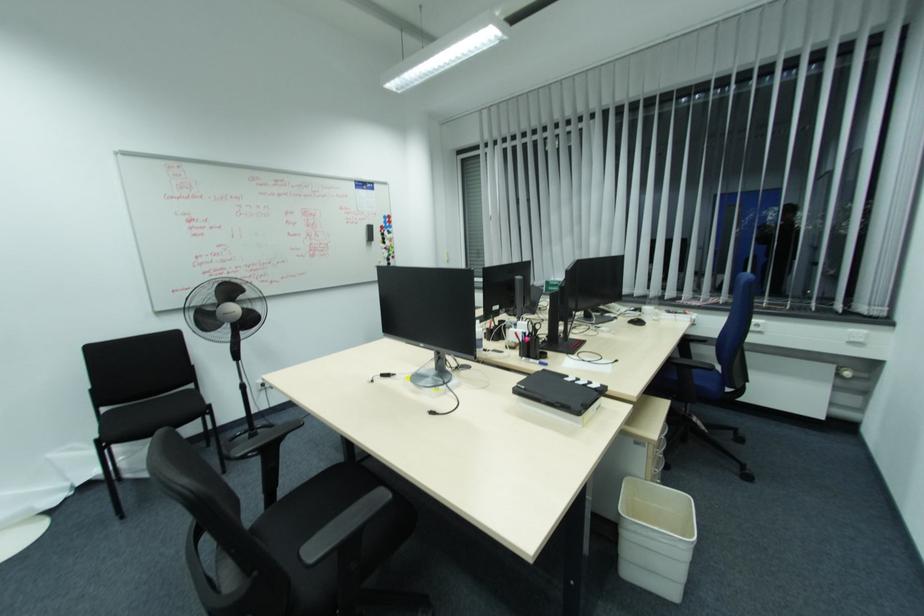
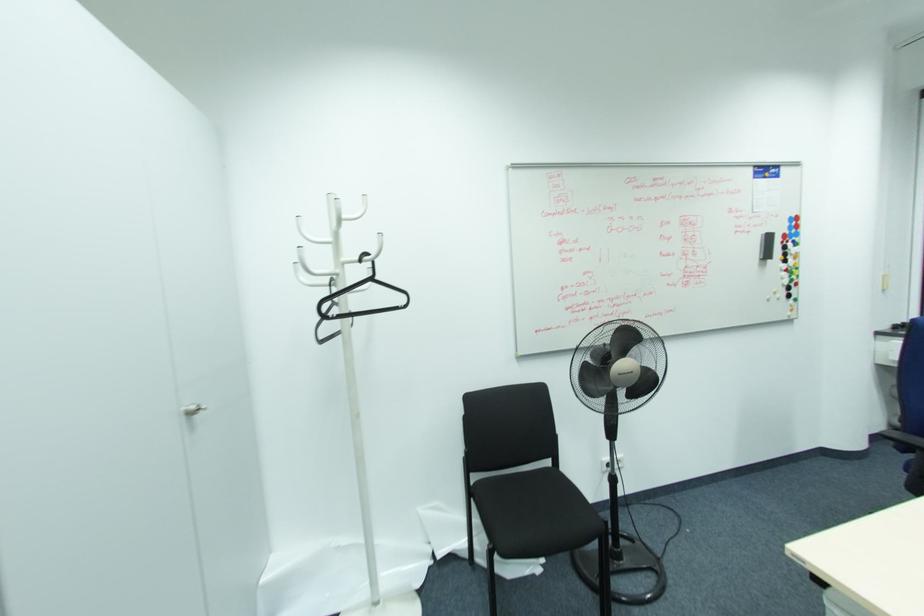
In the second image, find the point that corresponds to the point at 371,238 in the first image.

(768, 256)